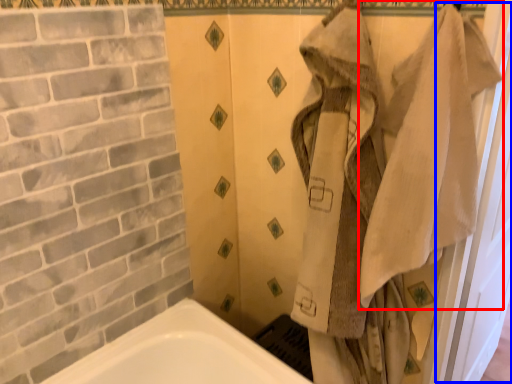
Question: Which of the following is the farthest to the observer, bath towel (highlighted by a red box) or screen door (highlighted by a blue box)?

Choices:
 (A) bath towel
 (B) screen door

Answer: (B)